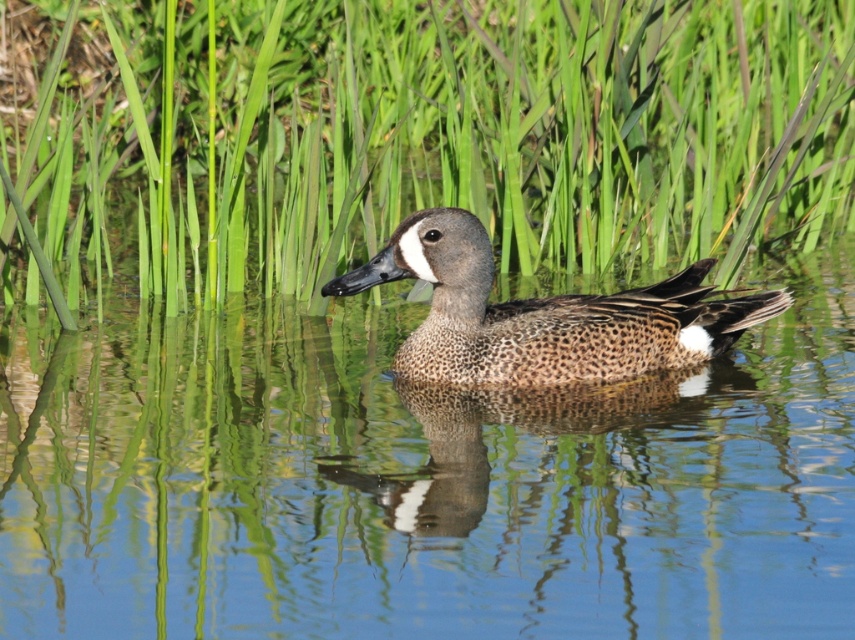
At what (x,y) coordinates should I click in order to perform the action: click on green grass at center. Please return your answer as a coordinate pair (x, y). The width and height of the screenshot is (855, 640). Looking at the image, I should click on (413, 138).

Find the location of a particular element. green grass at center is located at coordinates (413, 138).

You are a GUI agent. You are given a task and a screenshot of the screen. Output one action in this format:
    pyautogui.click(x=<x>, y=<y>)
    Task: Click on the green grass at center
    
    Given the screenshot: What is the action you would take?
    pyautogui.click(x=413, y=138)